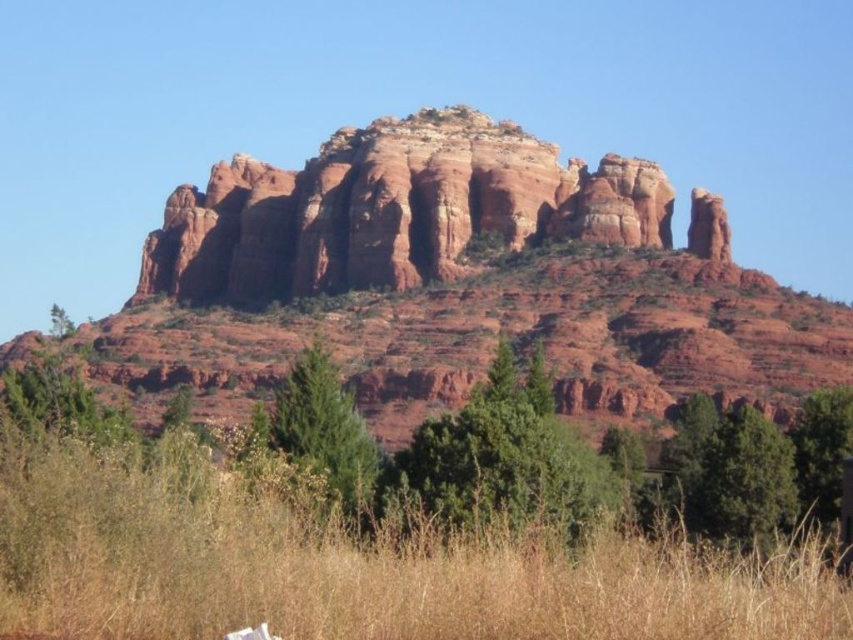
Does dry grass at lower center appear over reddish-brown rock formation at center?

No, dry grass at lower center is not above reddish-brown rock formation at center.

Who is taller, dry grass at lower center or reddish-brown rock formation at center?

reddish-brown rock formation at center

Between point (59, 500) and point (329, 154), which one is positioned behind?

The point (329, 154) is behind.

Where is `dry grass at lower center`? This screenshot has width=853, height=640. dry grass at lower center is located at coordinates (350, 566).